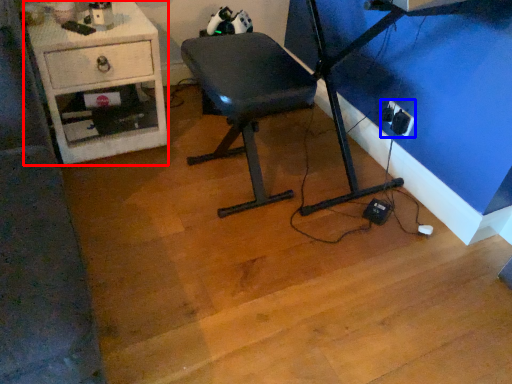
Question: Among these objects, which one is nearest to the camera, desk (highlighted by a red box) or electric outlet (highlighted by a blue box)?

Choices:
 (A) desk
 (B) electric outlet

Answer: (A)